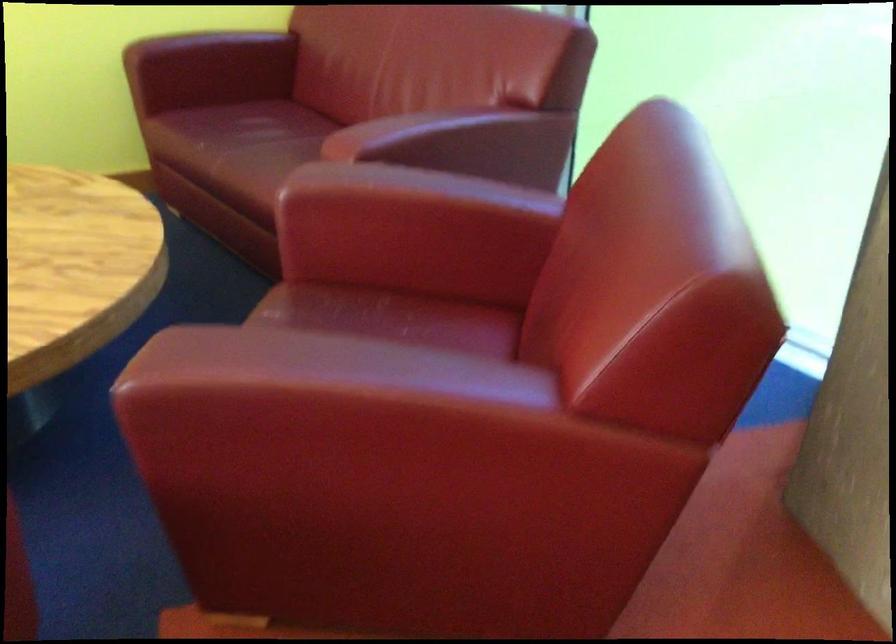
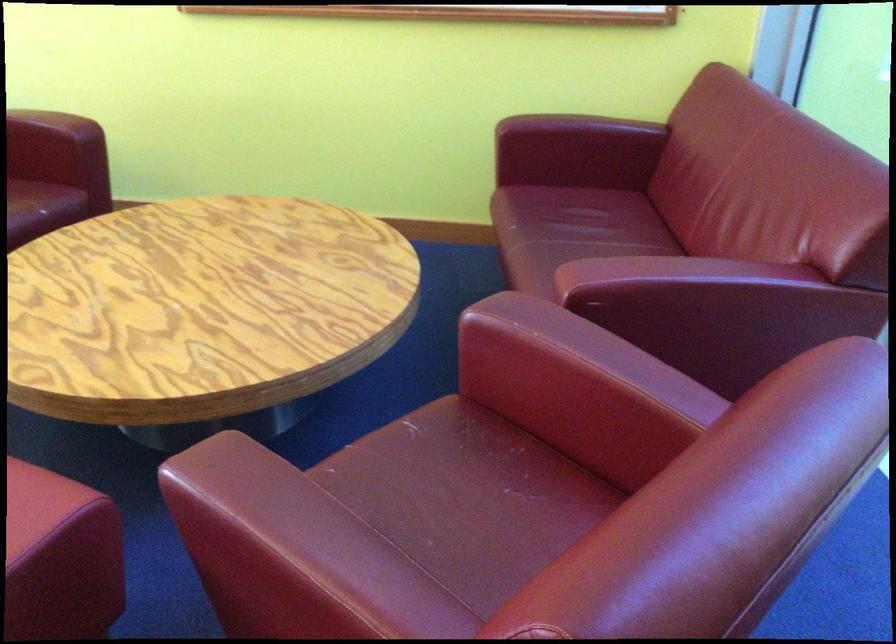
Find the pixel in the second image that matches point 271,114 in the first image.

(592, 210)